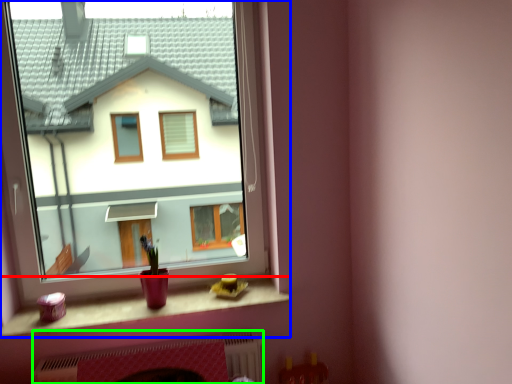
Question: Which is nearer to the window sill (highlighted by a red box)? window (highlighted by a blue box) or fireplace (highlighted by a green box).

Choices:
 (A) window
 (B) fireplace

Answer: (B)